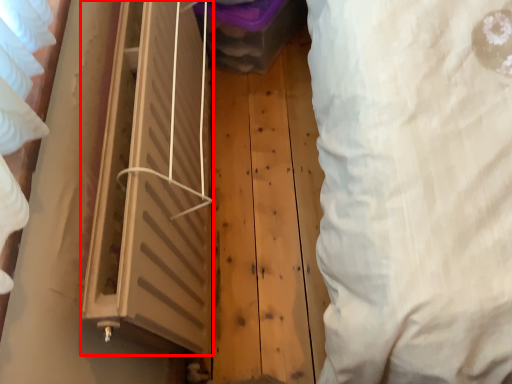
Question: From the image's perspective, what is the correct spatial positioning of window (annotated by the red box) in reference to curtain?

Choices:
 (A) above
 (B) below

Answer: (B)